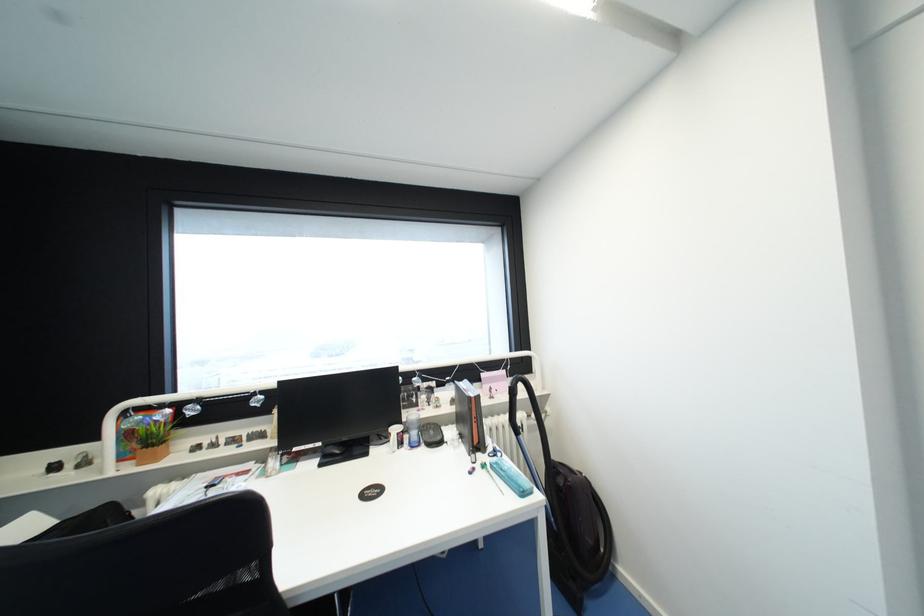
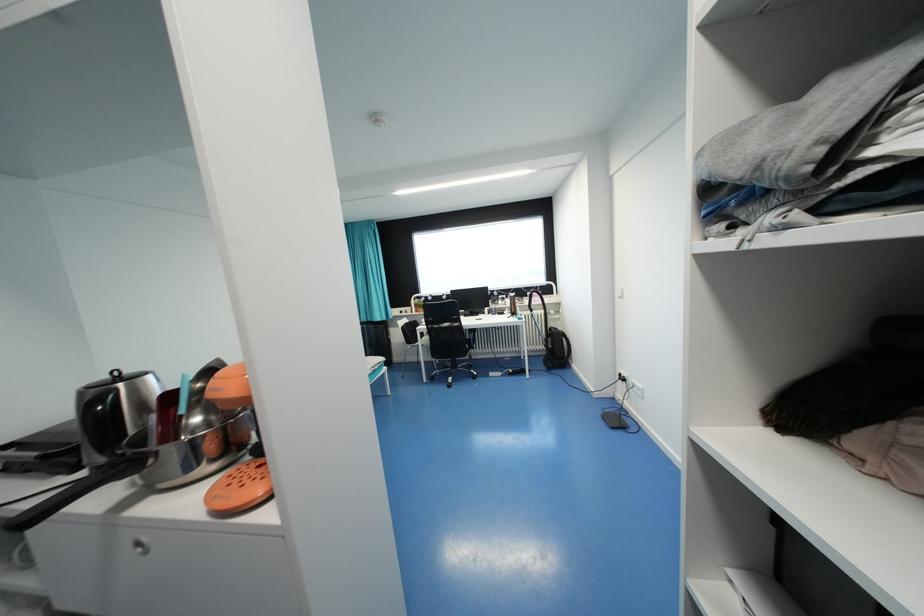
The images are taken continuously from a first-person perspective. In which direction are you moving?

The movement direction of the cameraman is right, backward.